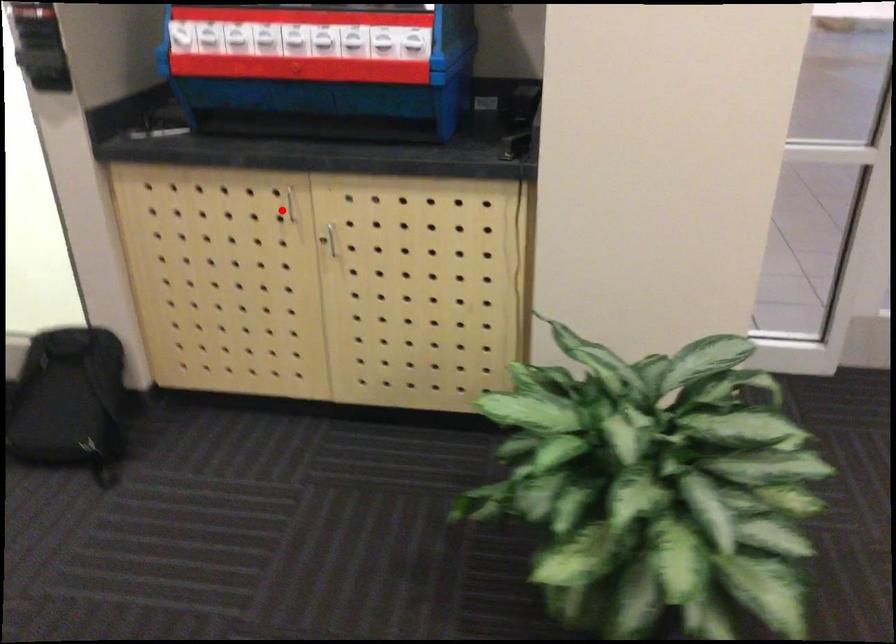
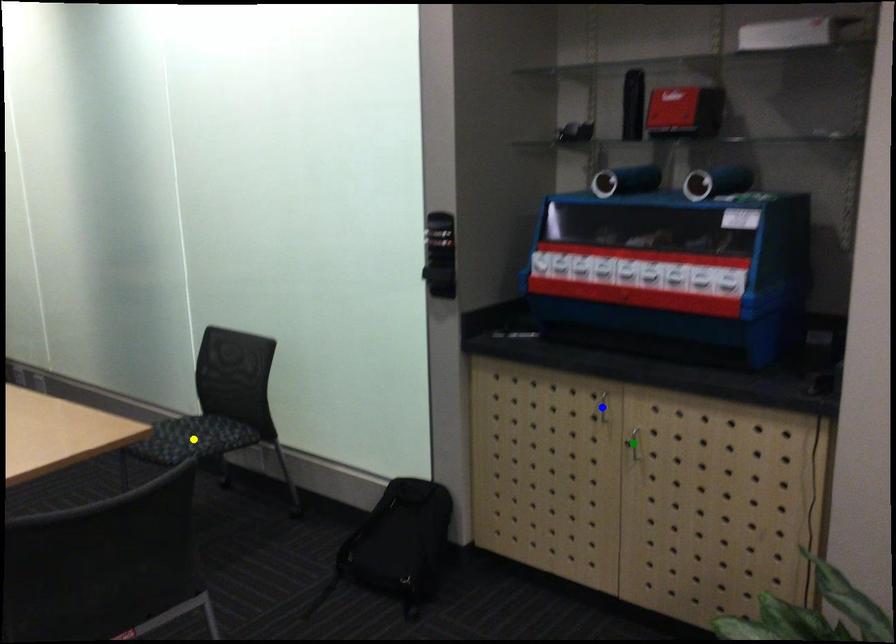
Question: I am providing you with two images of the same scene from different viewpoints. A red point is marked on the first image. You are given multiple points on the second image. Which point in image 2 represents the same 3d spot as the red point in image 1?

Choices:
 (A) yellow point
 (B) green point
 (C) blue point

Answer: (C)